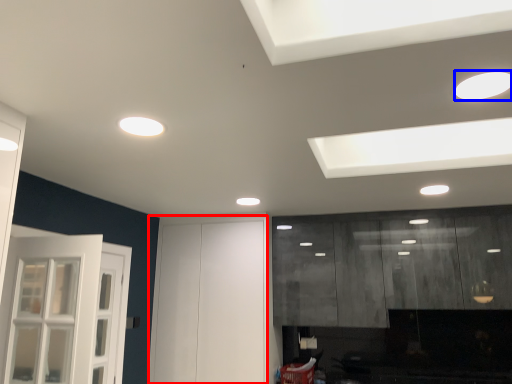
Question: Which object appears farthest to the camera in this image, door (highlighted by a red box) or lighting (highlighted by a blue box)?

Choices:
 (A) door
 (B) lighting

Answer: (A)